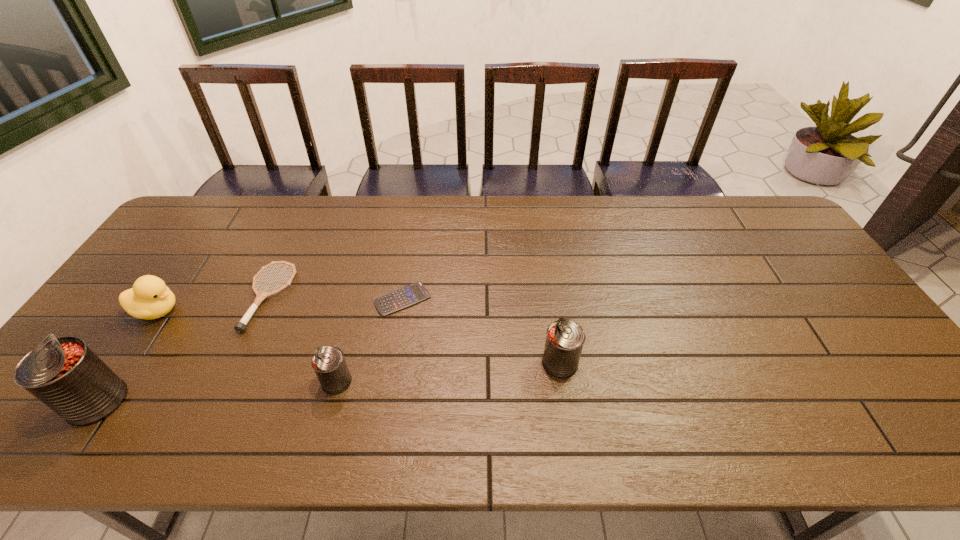
You are a GUI agent. You are given a task and a screenshot of the screen. Output one action in this format:
    pyautogui.click(x=<x>, y=<y>)
    Task: Click on the blank space that satisfies the following two spatial constraints: 1. on the front-facing side of the duck; 2. on the back side of the rightmost can
    The height and width of the screenshot is (540, 960).
    Given the screenshot: What is the action you would take?
    pyautogui.click(x=121, y=363)

Where is `free spot that satisfies the following two spatial constraints: 1. on the back side of the tallest object; 2. on the front-facing side of the duck`? The image size is (960, 540). free spot that satisfies the following two spatial constraints: 1. on the back side of the tallest object; 2. on the front-facing side of the duck is located at coordinates (158, 311).